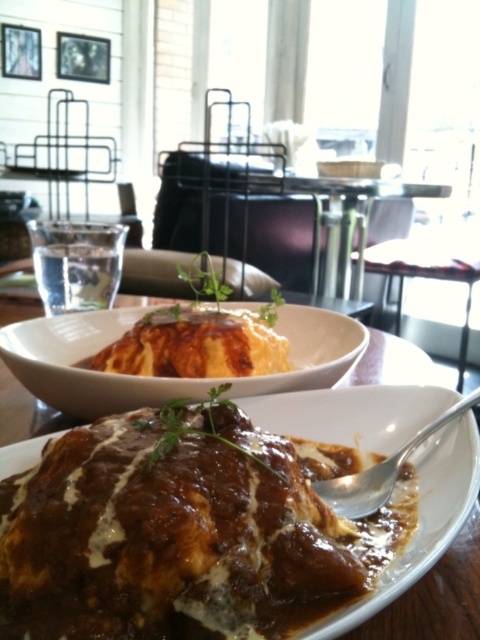
You are a food critic who wants to taste the saucy brown meat at center. If your hand is 8.98 inches long, can you reach it without moving your arm?

The saucy brown meat at center and viewer are 8.98 inches apart. Since your hand is 8.98 inches long, you can just barely reach it without moving your arm.

You are a food critic evaluating the presentation of this meal. Based on the image, which object is positioned lower in the scene between the saucy brown meat at center and the white glossy bowl at upper center?

The saucy brown meat at center is located below the white glossy bowl at upper center, so it is positioned lower in the scene.

You are a chef preparing a meal and need to decide which container to use for serving. The saucy brown meat at center needs to be portioned into either the white glossy bowl at upper center or another dish. Based on their sizes, which container would you choose and why?

The saucy brown meat at center has a smaller size compared to the white glossy bowl at upper center, so the white glossy bowl at upper center is large enough to accommodate the saucy brown meat at center without overcrowding.